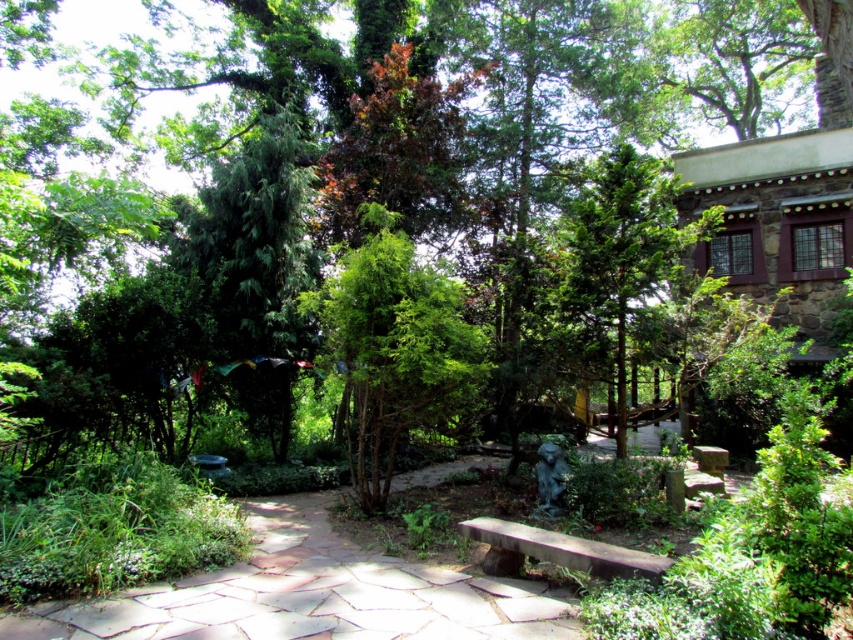
Question: Is green textured tree at upper left further to camera compared to green textured tree at upper center?

Choices:
 (A) yes
 (B) no

Answer: (A)

Question: Based on their relative distances, which object is nearer to the green textured tree at center?

Choices:
 (A) green textured tree at upper left
 (B) green textured tree at upper center
 (C) smooth stone bench at center

Answer: (C)

Question: Is green textured tree at center to the left of green textured tree at upper left from the viewer's perspective?

Choices:
 (A) yes
 (B) no

Answer: (B)

Question: Is green textured tree at center positioned at the back of green textured tree at upper center?

Choices:
 (A) yes
 (B) no

Answer: (B)

Question: Among these points, which one is nearest to the camera?

Choices:
 (A) (584, 328)
 (B) (281, 346)

Answer: (A)

Question: Which object is positioned closest to the green textured tree at upper left?

Choices:
 (A) green textured tree at upper center
 (B) smooth stone bench at center

Answer: (A)